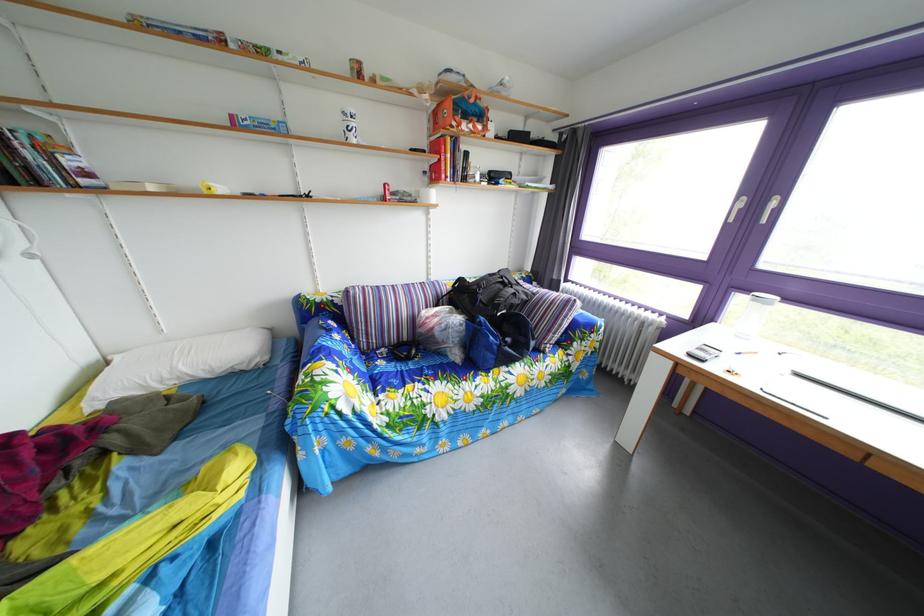
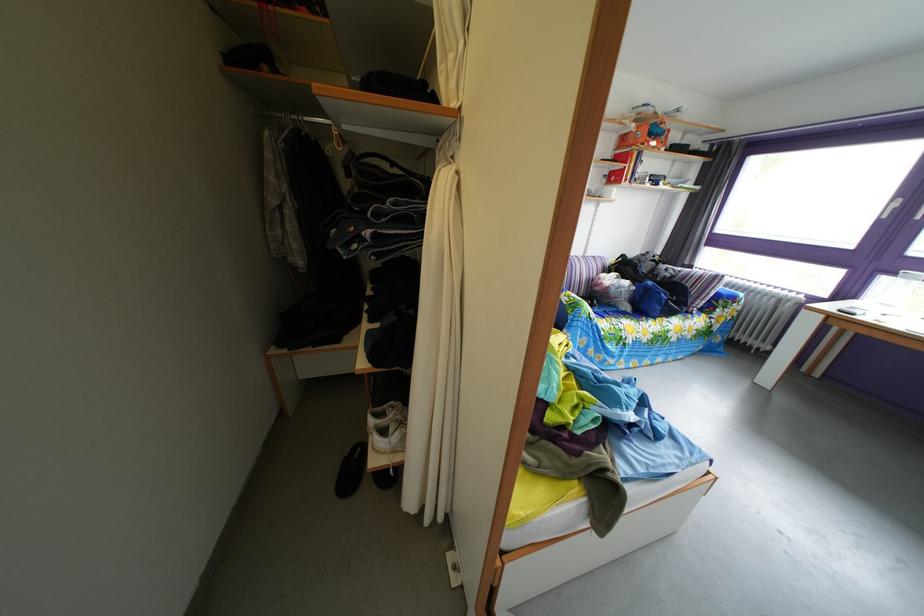
Find the pixel in the second image that matches the point at 438,176 in the first image.

(618, 180)